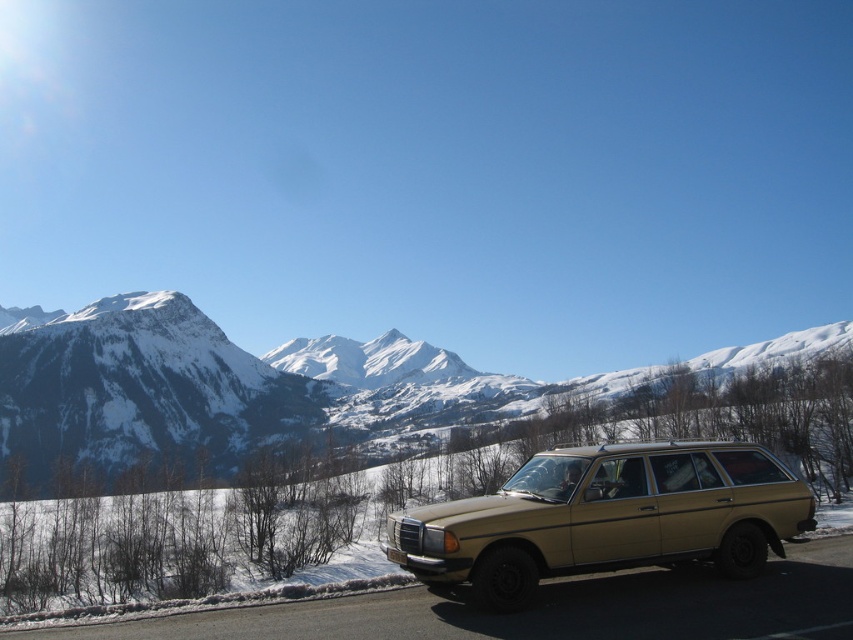
Is snowy white mountain range at upper left taller than gold metallic station wagon at lower right?

Yes.

Which is more to the left, snowy white mountain range at upper left or gold metallic station wagon at lower right?

snowy white mountain range at upper left is more to the left.

Between point (796, 396) and point (596, 560), which one is positioned in front?

Positioned in front is point (596, 560).

What are the coordinates of `snowy white mountain range at upper left` in the screenshot? It's located at (364, 400).